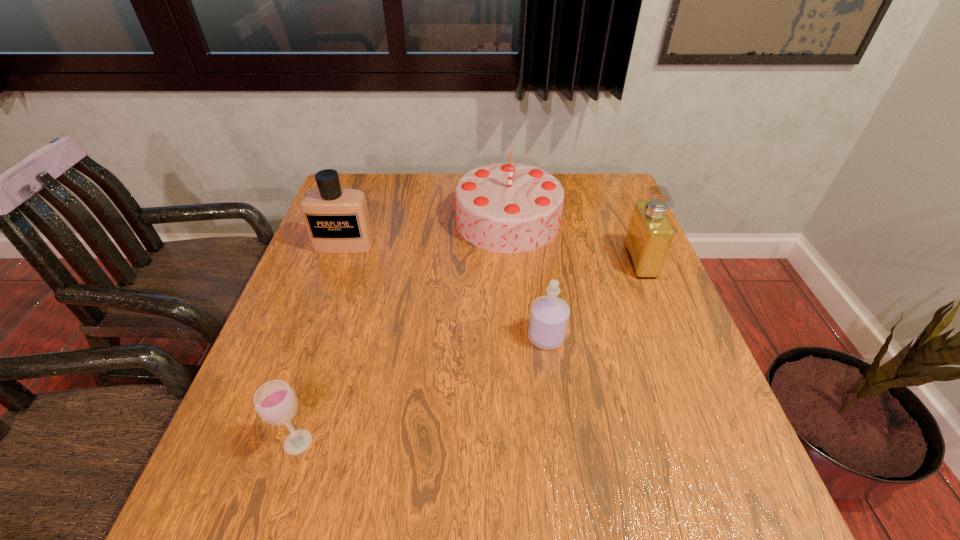
Where is `unoccupied area between the second perfume from left to right and the leftmost perfume`? The width and height of the screenshot is (960, 540). unoccupied area between the second perfume from left to right and the leftmost perfume is located at coordinates (445, 291).

Identify the location of free space between the fourth farthest object and the leftmost perfume. (445, 291).

The width and height of the screenshot is (960, 540). What are the coordinates of `free space between the second perfume from left to right and the rightmost perfume` in the screenshot? It's located at (593, 299).

Locate which object ranks in proximity to the rightmost perfume. Please provide its 2D coordinates. Your answer should be formatted as a tuple, i.e. [(x, y)], where the tuple contains the x and y coordinates of a point satisfying the conditions above.

[(507, 207)]

Where is `object that is the closest to the leftmost perfume`? object that is the closest to the leftmost perfume is located at coordinates (507, 207).

The height and width of the screenshot is (540, 960). I want to click on the closest perfume to the rightmost perfume, so click(x=549, y=315).

The width and height of the screenshot is (960, 540). I want to click on the closest perfume to the rightmost perfume, so click(549, 315).

I want to click on vacant region that satisfies the following two spatial constraints: 1. on the front label of the second perfume from right to left; 2. on the right side of the leftmost perfume, so click(x=311, y=337).

At what (x,y) coordinates should I click in order to perform the action: click on vacant area that satisfies the following two spatial constraints: 1. on the front label of the wineglass; 2. on the right side of the leftmost perfume. Please return your answer as a coordinate pair (x, y). The image size is (960, 540). Looking at the image, I should click on (275, 442).